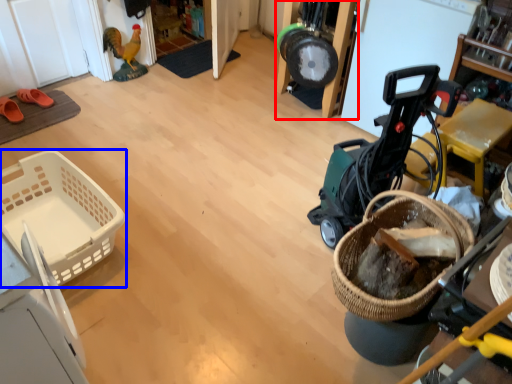
Question: Among these objects, which one is farthest to the camera, furniture (highlighted by a red box) or basket (highlighted by a blue box)?

Choices:
 (A) furniture
 (B) basket

Answer: (A)